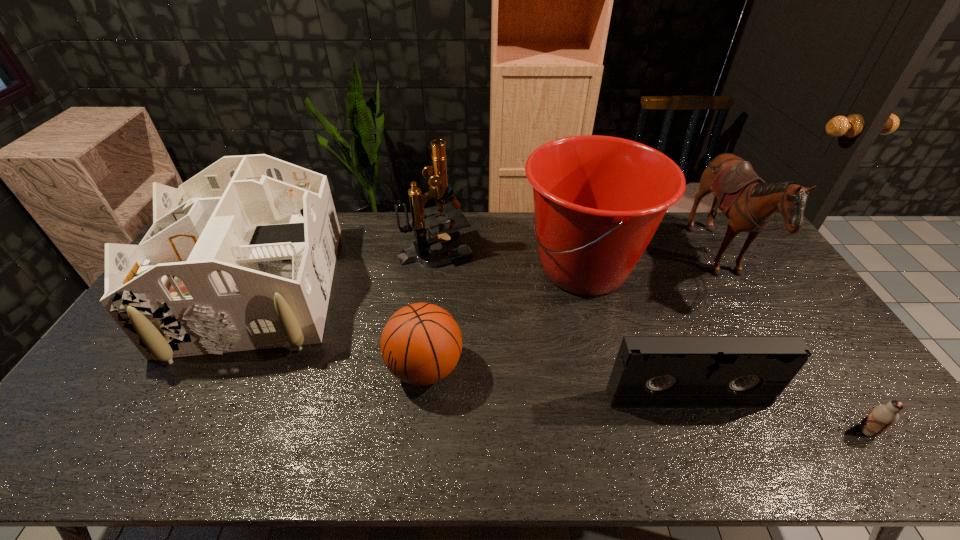
You are a GUI agent. You are given a task and a screenshot of the screen. Output one action in this format:
    pyautogui.click(x=<x>, y=<y>)
    Task: Click on the vacant space that is in between the fourth shortest object and the basketball
    Image resolution: width=960 pixels, height=540 pixels.
    Given the screenshot: What is the action you would take?
    pyautogui.click(x=341, y=329)

Find the location of `free space between the bucket and the saddle`. free space between the bucket and the saddle is located at coordinates (651, 265).

Find the location of a particular element. free spot between the bucket and the videotape is located at coordinates coord(635,334).

Select which object is the fifth closest to the basketball. Please provide its 2D coordinates. Your answer should be formatted as a tuple, i.e. [(x, y)], where the tuple contains the x and y coordinates of a point satisfying the conditions above.

[(749, 203)]

Point out which object is positioned as the second nearest to the microscope. Please provide its 2D coordinates. Your answer should be formatted as a tuple, i.e. [(x, y)], where the tuple contains the x and y coordinates of a point satisfying the conditions above.

[(241, 256)]

Where is `blank area in the image that satisfies the following two spatial constraints: 1. at the eyepiece of the microscope; 2. on the back side of the basketball`? This screenshot has height=540, width=960. blank area in the image that satisfies the following two spatial constraints: 1. at the eyepiece of the microscope; 2. on the back side of the basketball is located at coordinates (422, 368).

The image size is (960, 540). I want to click on vacant space that satisfies the following two spatial constraints: 1. at the eyepiece of the microscope; 2. on the right side of the basketball, so click(x=422, y=368).

This screenshot has height=540, width=960. What are the coordinates of `free space that satisfies the following two spatial constraints: 1. on the side of the chocolate milk with visible spindles; 2. on the left side of the videotape` in the screenshot? It's located at (699, 431).

At what (x,y) coordinates should I click in order to perform the action: click on free location that satisfies the following two spatial constraints: 1. with the handle attached to the rim of the bucket; 2. on the front side of the leftmost object. Please return your answer as a coordinate pair (x, y). Looking at the image, I should click on (589, 291).

Where is `free region that satisfies the following two spatial constraints: 1. at the eyepiece of the microscope; 2. on the right side of the basketball`? The height and width of the screenshot is (540, 960). free region that satisfies the following two spatial constraints: 1. at the eyepiece of the microscope; 2. on the right side of the basketball is located at coordinates (422, 368).